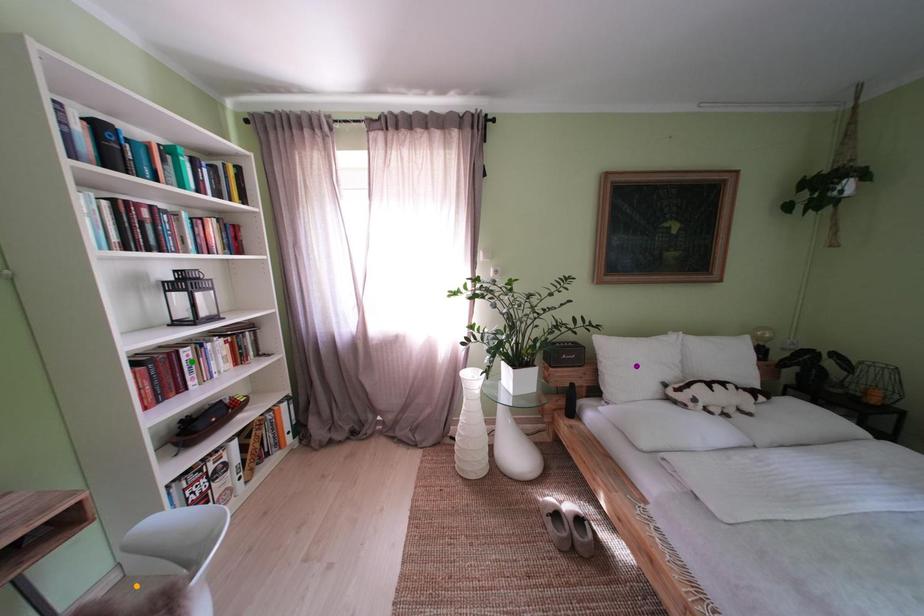
Order these from farthest to nearest:
1. purple point
2. green point
3. orange point

1. purple point
2. green point
3. orange point